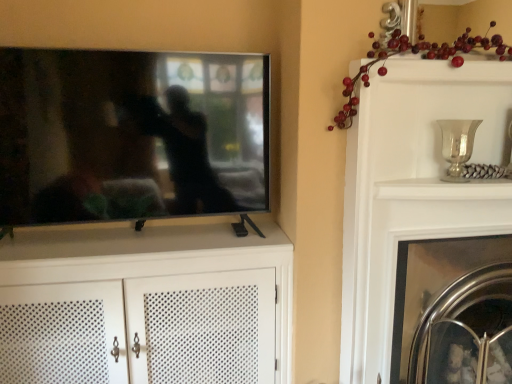
Question: Is point (68, 142) positioned closer to the camera than point (452, 150)?

Choices:
 (A) farther
 (B) closer

Answer: (A)

Question: From a real-world perspective, relative to silver metallic vase at upper right, is flat screen tv at left vertically above or below?

Choices:
 (A) below
 (B) above

Answer: (B)

Question: Considering the real-world distances, which object is farthest from the white perforated cabinet at center?

Choices:
 (A) polished chrome fireplace at right
 (B) silver metallic vase at upper right
 (C) clear glass fireplace screen at center-right
 (D) glossy red berries at upper right
 (E) flat screen tv at left

Answer: (B)

Question: Which object is the closest to the flat screen tv at left?

Choices:
 (A) polished chrome fireplace at right
 (B) glossy red berries at upper right
 (C) silver metallic vase at upper right
 (D) clear glass fireplace screen at center-right
 (E) white perforated cabinet at center

Answer: (E)